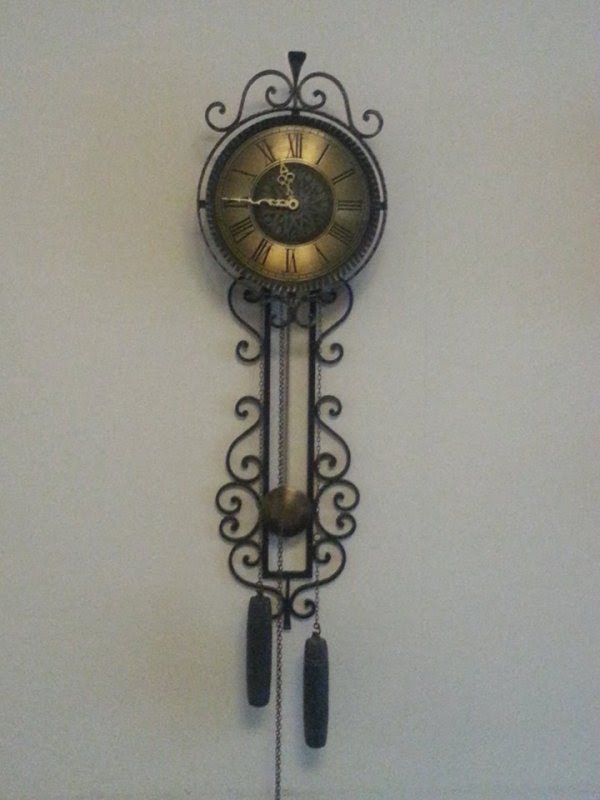
You are a GUI agent. You are given a task and a screenshot of the screen. Output one action in this format:
    pyautogui.click(x=<x>, y=<y>)
    Task: Click on the clock hands
    The image size is (600, 800).
    Given the screenshot: What is the action you would take?
    click(286, 184), click(254, 201)